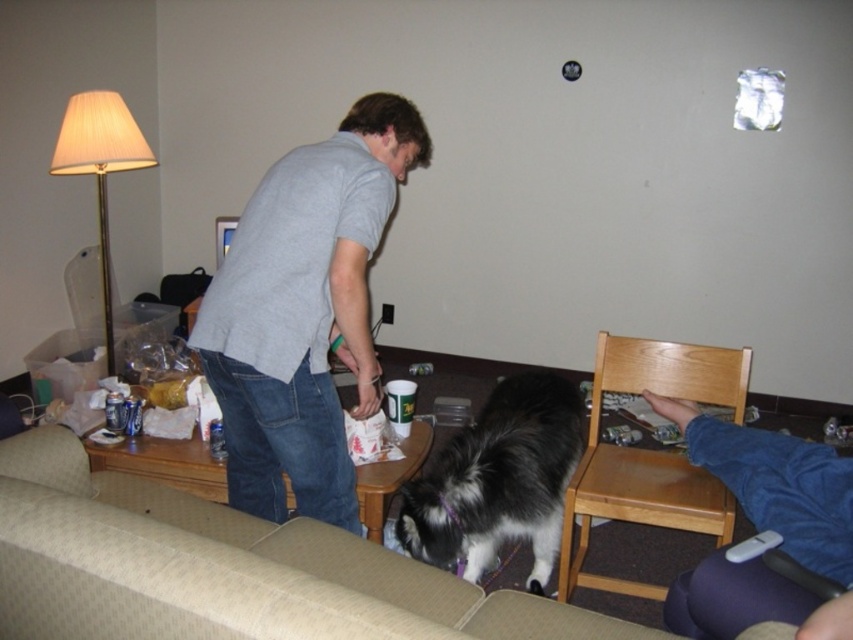
You are trying to rearrange the furniture in the living room. If you want to move the wooden table at center closer to the beige fabric couch at lower left, which object should you move first and why?

You should move the wooden table at center first because it is narrower than the beige fabric couch at lower left, making it easier to maneuver around the space.

You are a guest in this living room and want to place a 1.2 meter tall potted plant on the wooden table at center. Can the gray cotton shirt at center be placed on the table without blocking the plant?

The gray cotton shirt at center is much taller than the wooden table at center, so placing it on the table would cause the shirt to extend beyond the table, potentially blocking the plant.

You are a photographer standing at the camera position. You want to take a photo of the beige fabric couch at lower left. Can you fit the entire couch into your camera frame without moving your position? The camera has a standard 50mm lens with a 46 degree angle of view.

The beige fabric couch at lower left and camera are 4.48 feet apart. To determine if the couch fits in the frame, we calculate the maximum width the camera can capture at that distance. Using the formula width_at_distance 4.48 feet 46 degrees, the maximum width is approximately 3.5 feet. Since the couch is likely wider than 3.5 feet, it won